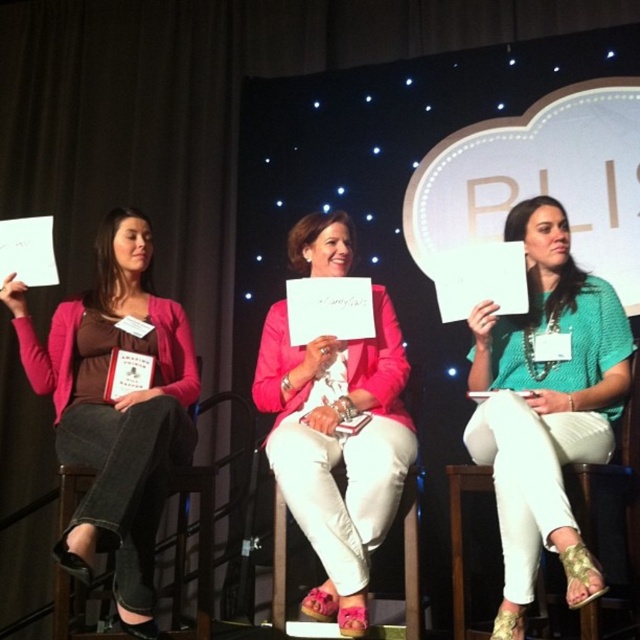
You are an event organizer checking the seating arrangement for the panel discussion. You notice the matte pink sweater at left and the pink fabric jacket at center. Which one is covering part of the other?

The matte pink sweater at left is positioned over the pink fabric jacket at center, so it is covering part of it.

You are an event organizer arranging the seating for the panel discussion. You need to place a name tag on the seat of the denim fabric chair at left. Where should you place it in relation to the pink fabric jacket at center?

The pink fabric jacket at center is positioned on the right side of denim fabric chair at left, so the name tag should be placed on the left side of the pink fabric jacket at center to align with the denim fabric chair at left.